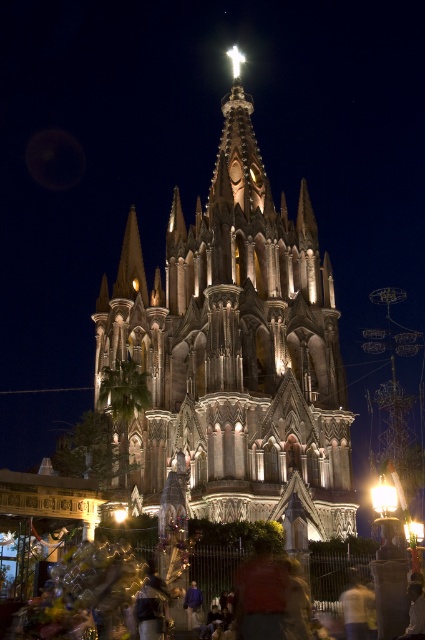
Between dark brown stone tower at center and purple fabric at center, which one appears on the left side from the viewer's perspective?

dark brown stone tower at center

Measure the distance between dark brown stone tower at center and purple fabric at center.

dark brown stone tower at center is 32.91 meters away from purple fabric at center.

Which is behind, point (306, 474) or point (192, 584)?

The point (306, 474) is more distant.

Identify the location of dark brown stone tower at center. This screenshot has width=425, height=640. (235, 348).